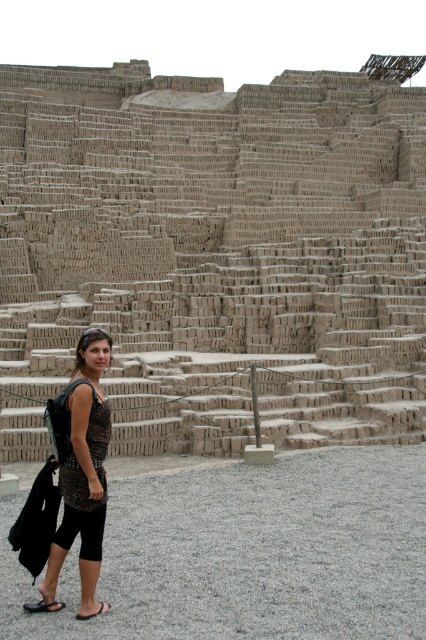
You are a tourist standing at the base of the pyramid. You see the brown clay stairs at center and the brown leather sandal at lower left. Which object is taller?

The brown clay stairs at center is much taller than the brown leather sandal at lower left.

You are a photographer planning to take a picture of the brown clay stairs at center and the leopard print dress at center. Which object should you focus on first if you want to capture both in the same frame without moving the camera?

The leopard print dress at center should be focused on first because it is shorter than the brown clay stairs at center, allowing the stairs to remain in the background while keeping the dress in the foreground within the same frame.